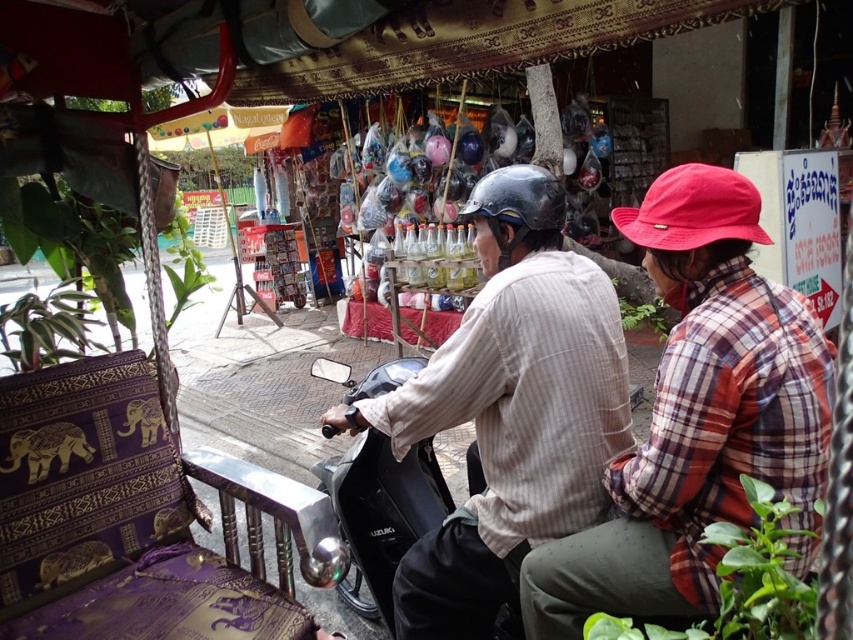
You are standing at the edge of the market street and see both the plaid fabric shirt at center and the striped cotton shirt at center. Which shirt is located to the right when facing towards the scene?

The plaid fabric shirt at center is positioned on the right side of striped cotton shirt at center, so the plaid fabric shirt at center is located to the right.

Based on the scene description, where is the plaid fabric shirt at center located in the image?

The plaid fabric shirt at center is located at point [698,417] in the image.

You are standing in the market area and want to know which of the two points, point [773,385] or point [601,500], is closer to you. Based on the scene, which point is nearer?

Point [773,385] is closer to the viewer than point [601,500].